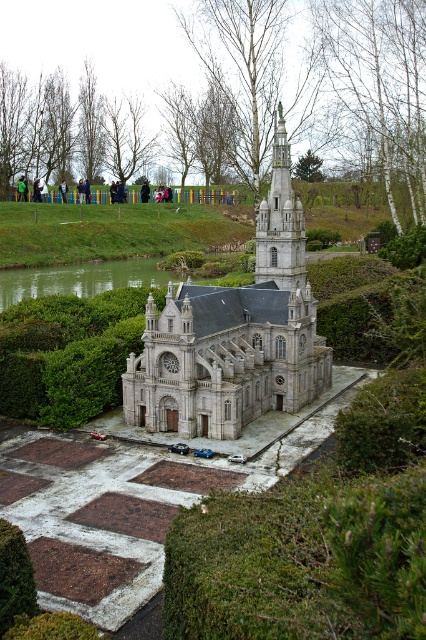
Question: Which point is farther from the camera taking this photo?

Choices:
 (A) (276, 129)
 (B) (104, 264)
 (C) (347, 316)

Answer: (B)

Question: Is stone church at center to the left of white stone tower at upper center from the viewer's perspective?

Choices:
 (A) yes
 (B) no

Answer: (A)

Question: Which object is closer to the camera taking this photo?

Choices:
 (A) green grass at center
 (B) white stone tower at upper center
 (C) green smooth water at center

Answer: (A)

Question: Can you confirm if green grass at center is positioned above green smooth water at center?

Choices:
 (A) yes
 (B) no

Answer: (B)

Question: Which of the following is the farthest from the observer?

Choices:
 (A) green grass at center
 (B) green smooth water at center
 (C) white stone tower at upper center

Answer: (B)

Question: Does green grass at center appear under white stone tower at upper center?

Choices:
 (A) yes
 (B) no

Answer: (A)